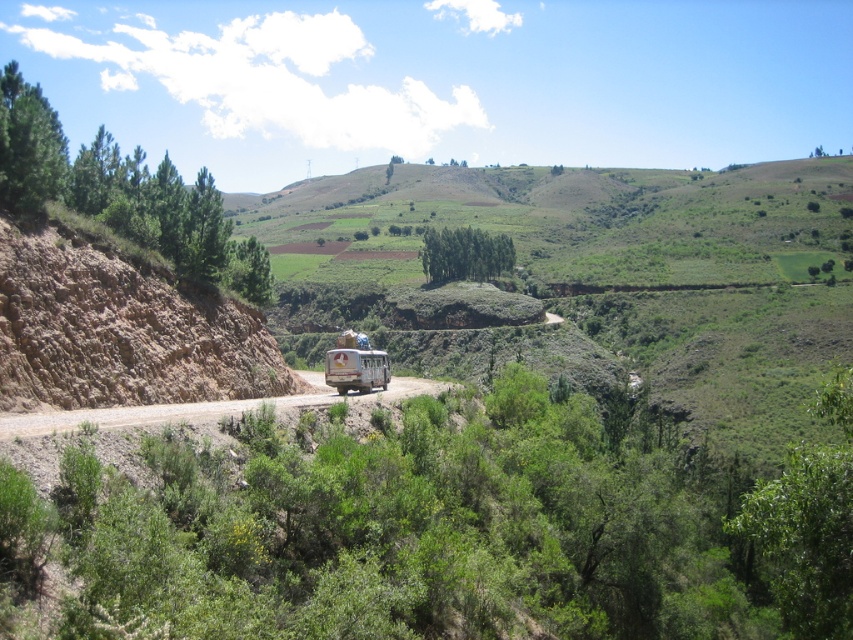
How much distance is there between green matte tree at upper left and green leafy trees at center?

A distance of 133.87 meters exists between green matte tree at upper left and green leafy trees at center.

Who is taller, green matte tree at upper left or green leafy trees at center?

green matte tree at upper left is taller.

Is point (19, 145) farther from viewer compared to point (485, 268)?

No, (19, 145) is closer to viewer.

The width and height of the screenshot is (853, 640). I want to click on green matte tree at upper left, so click(28, 145).

Does brown dirt at left come behind green leafy trees at left?

No.

Is brown dirt at left closer to camera compared to green leafy trees at left?

Yes.

The height and width of the screenshot is (640, 853). Describe the element at coordinates (120, 332) in the screenshot. I see `brown dirt at left` at that location.

Image resolution: width=853 pixels, height=640 pixels. I want to click on brown dirt at left, so click(x=120, y=332).

Which is below, green leafy trees at center or rusty metal bus at center?

rusty metal bus at center is below.

Does point (465, 250) come in front of point (387, 369)?

No, it is behind (387, 369).

Is point (502, 266) farther from viewer compared to point (368, 369)?

Yes.

Where is `green leafy trees at center`? The height and width of the screenshot is (640, 853). green leafy trees at center is located at coordinates (465, 253).